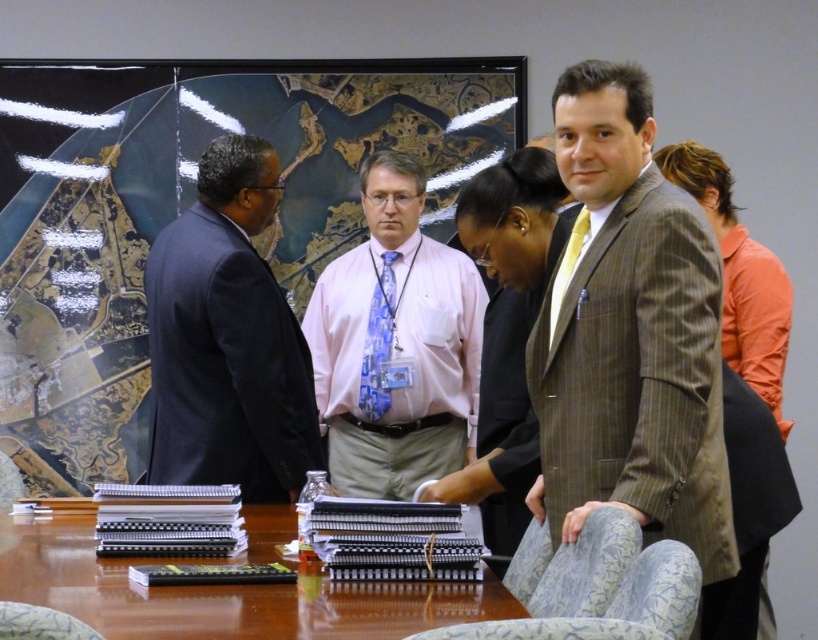
You are organizing a meeting and need to ensure that all attendees can comfortably sit around the brown wooden table at center. Considering the size of the dark blue suit at left, will there be enough space for everyone?

A: The dark blue suit at left is bigger than the brown wooden table at center, which suggests the table may be too small to accommodate all attendees comfortably. Consider choosing a larger table or fewer participants.

You are organizing a formal event and need to decide which attire between the brown pinstripe suit at center and the pink fabric shirt at center would be more appropriate for a narrow hallway. Which one would you choose and why?

The brown pinstripe suit at center is thinner than the pink fabric shirt at center, so it would be more appropriate for a narrow hallway as it takes up less space.